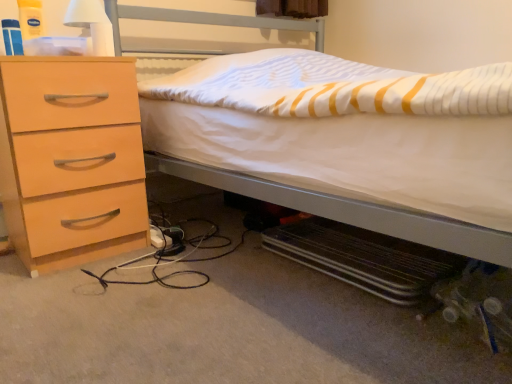
Question: Should I look upward or downward to see white matte bed at center?

Choices:
 (A) down
 (B) up

Answer: (B)

Question: Considering the relative sizes of white matte bed at center and light wood/finish chest of drawers at left in the image provided, is white matte bed at center smaller than light wood/finish chest of drawers at left?

Choices:
 (A) no
 (B) yes

Answer: (A)

Question: From the image's perspective, is white matte bed at center below light wood/finish chest of drawers at left?

Choices:
 (A) no
 (B) yes

Answer: (A)

Question: Is white matte bed at center surrounding light wood/finish chest of drawers at left?

Choices:
 (A) no
 (B) yes

Answer: (A)

Question: From the image's perspective, is white matte bed at center located above light wood/finish chest of drawers at left?

Choices:
 (A) no
 (B) yes

Answer: (B)

Question: From a real-world perspective, is white matte bed at center beneath light wood/finish chest of drawers at left?

Choices:
 (A) yes
 (B) no

Answer: (B)

Question: Can you confirm if white matte bed at center is positioned to the left of light wood/finish chest of drawers at left?

Choices:
 (A) no
 (B) yes

Answer: (A)

Question: Is there a large distance between white matte lampshade at upper left and light wood/finish chest of drawers at left?

Choices:
 (A) yes
 (B) no

Answer: (B)

Question: Is the depth of white matte lampshade at upper left greater than that of light wood/finish chest of drawers at left?

Choices:
 (A) yes
 (B) no

Answer: (A)

Question: Is white matte lampshade at upper left completely or partially outside of light wood/finish chest of drawers at left?

Choices:
 (A) yes
 (B) no

Answer: (A)

Question: From a real-world perspective, is white matte lampshade at upper left located higher than light wood/finish chest of drawers at left?

Choices:
 (A) no
 (B) yes

Answer: (B)

Question: Is white matte lampshade at upper left thinner than light wood/finish chest of drawers at left?

Choices:
 (A) yes
 (B) no

Answer: (A)

Question: Considering the relative positions of white matte lampshade at upper left and light wood/finish chest of drawers at left in the image provided, is white matte lampshade at upper left to the left of light wood/finish chest of drawers at left from the viewer's perspective?

Choices:
 (A) no
 (B) yes

Answer: (A)

Question: Can you confirm if white matte bed at center is shorter than white matte lampshade at upper left?

Choices:
 (A) yes
 (B) no

Answer: (B)